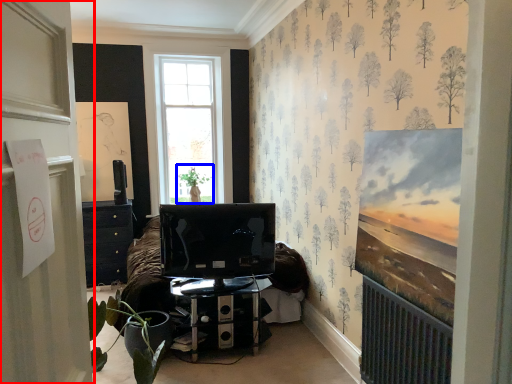
Question: Which point is closer to the camera, door (highlighted by a red box) or plant (highlighted by a blue box)?

Choices:
 (A) door
 (B) plant

Answer: (A)